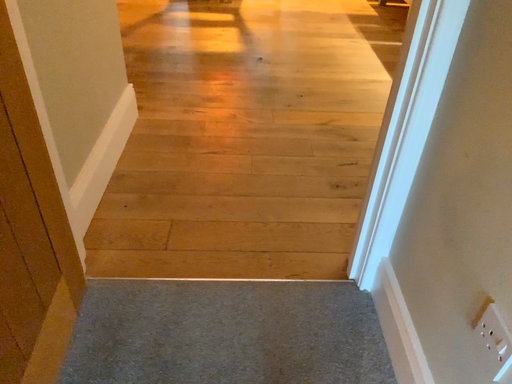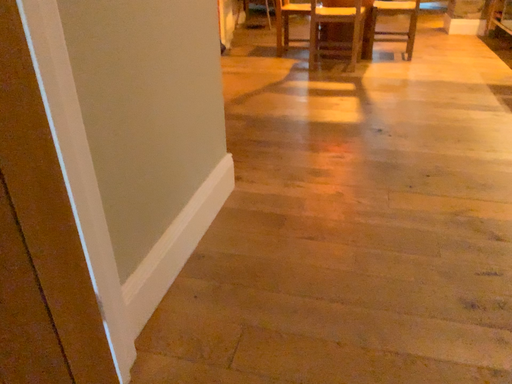
Question: Which way did the camera rotate in the video?

Choices:
 (A) rotated left
 (B) rotated right

Answer: (A)